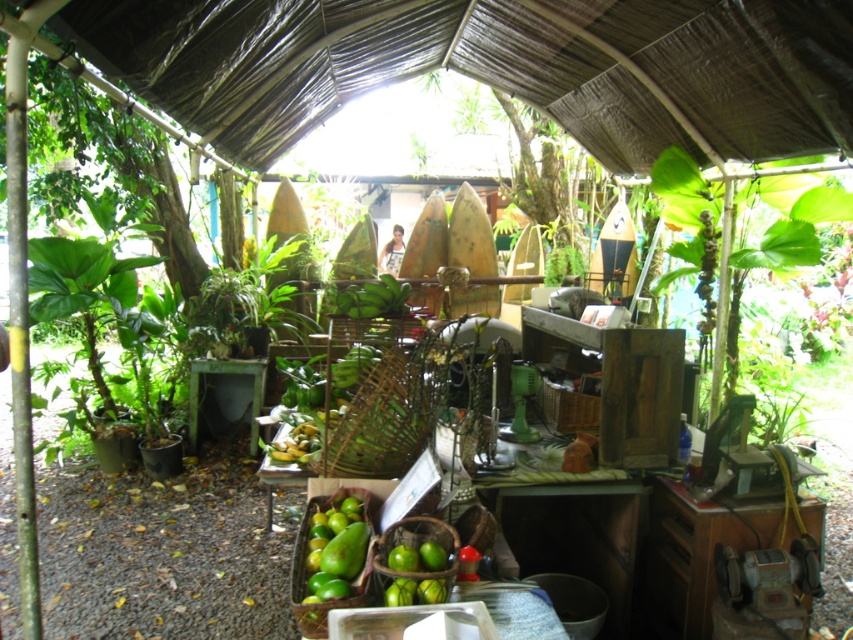
You are a customer standing at the entrance of the market stall. You see the green matte mangoes at lower center and the green leafy plant at upper center. How far apart are these two items from each other?

The green matte mangoes at lower center are 6.51 meters away from the green leafy plant at upper center.

You are standing at the entrance of the market stall and want to buy some mangoes. Where are the green matte mangoes at lower center located relative to the entrance?

The green matte mangoes at lower center are located at point (x=335, y=550) relative to the entrance, which means they are positioned towards the lower center area of the stall.

You are a customer at the market stall and want to know if there is enough space to place a large basket between the green matte mangoes at lower center and the green leafy plant at upper center. Based on their sizes, can you determine if the space between them is sufficient?

The green matte mangoes at lower center occupies less space than green leafy plant at upper center. Therefore, the space between them may be sufficient for a large basket, but it depends on the exact dimensions of the basket and the available gap between the two objects.